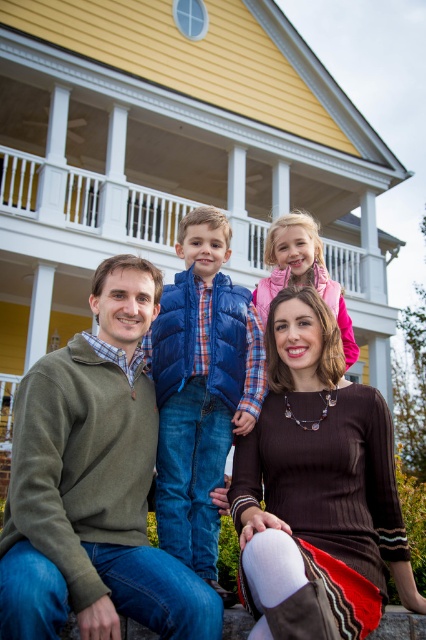
Question: Does blue puffy vest at center have a larger size compared to brown sweater at lower center?

Choices:
 (A) no
 (B) yes

Answer: (A)

Question: Based on their relative distances, which object is farther from the brown sweater at lower center?

Choices:
 (A) brown knitted sweater at center
 (B) blue puffy vest at center
 (C) pink fleece jacket at center

Answer: (A)

Question: Is blue puffy vest at center positioned at the back of white wooden porch at upper center?

Choices:
 (A) no
 (B) yes

Answer: (A)

Question: Which of these objects is positioned closest to the pink fleece jacket at center?

Choices:
 (A) white wooden porch at upper center
 (B) blue puffy vest at center

Answer: (B)

Question: Can you confirm if brown knitted sweater at center is positioned below brown sweater at lower center?

Choices:
 (A) no
 (B) yes

Answer: (B)

Question: Which object is the closest to the pink fleece jacket at center?

Choices:
 (A) white wooden porch at upper center
 (B) blue fleece vest at upper center
 (C) blue puffy vest at center
 (D) brown knitted sweater at center

Answer: (C)